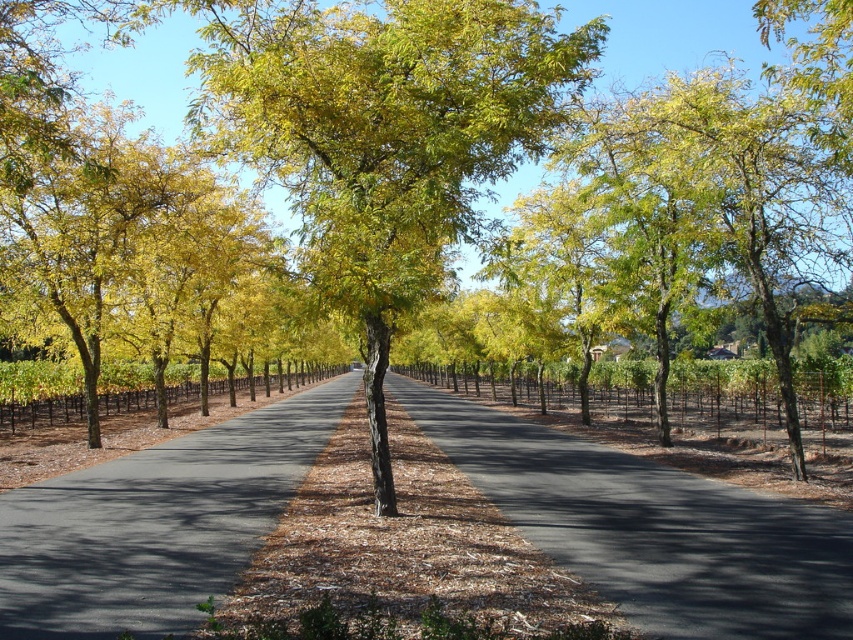
Question: Which object appears closest to the camera in this image?

Choices:
 (A) brown asphalt road at center
 (B) green leafy tree at center
 (C) brown dirt road at center

Answer: (A)

Question: Based on their relative distances, which object is farther from the green leafy tree at center?

Choices:
 (A) brown asphalt road at center
 (B) brown dirt road at center

Answer: (B)

Question: Is green leafy tree at center thinner than brown asphalt road at center?

Choices:
 (A) yes
 (B) no

Answer: (B)

Question: Which object is the closest to the brown dirt road at center?

Choices:
 (A) brown asphalt road at center
 (B) green leafy tree at center

Answer: (A)

Question: Does brown dirt road at center appear on the left side of brown asphalt road at center?

Choices:
 (A) yes
 (B) no

Answer: (B)

Question: Observing the image, what is the correct spatial positioning of green leafy tree at center in reference to brown asphalt road at center?

Choices:
 (A) above
 (B) below

Answer: (A)